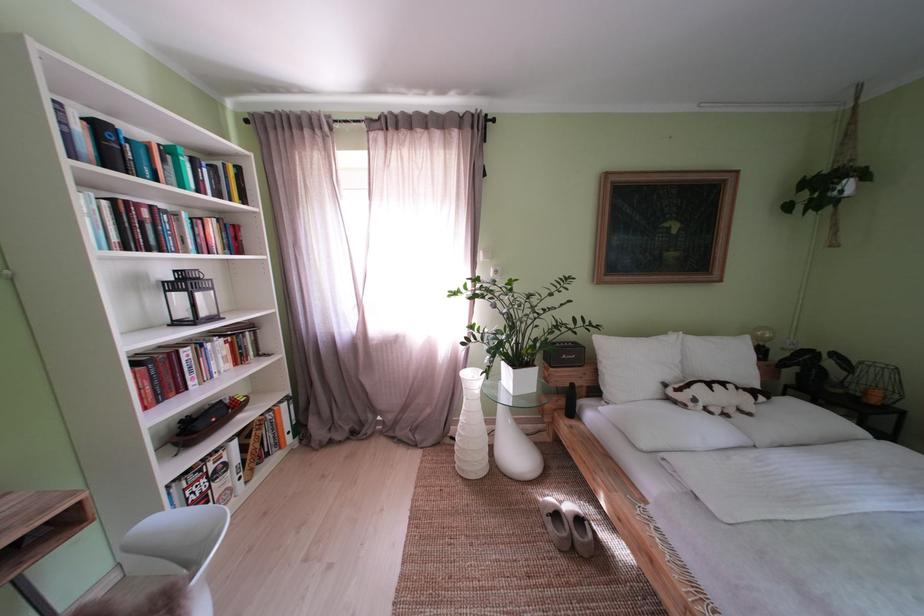
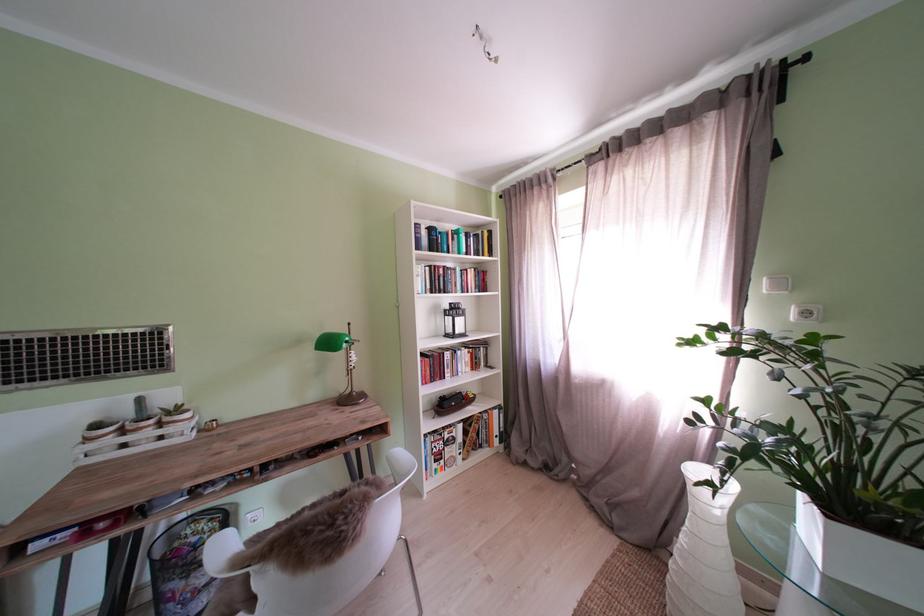
Locate, in the second image, the point that corresponds to point (444, 119) in the first image.

(681, 116)